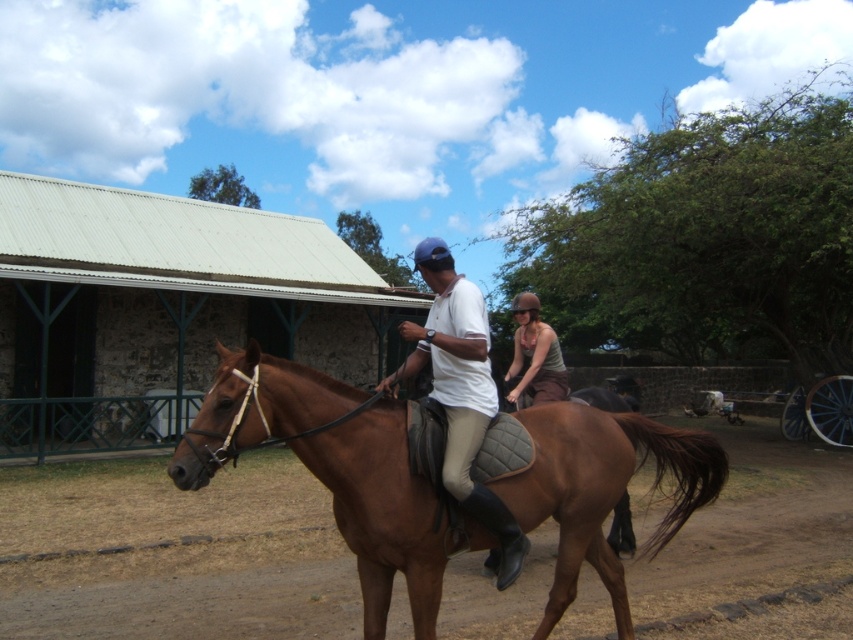
Question: Which object is closer to the camera taking this photo?

Choices:
 (A) white matte shirt at center
 (B) matte brown helmet at center

Answer: (A)

Question: Is brown glossy horse at center below matte brown helmet at center?

Choices:
 (A) no
 (B) yes

Answer: (B)

Question: Is white matte shirt at center wider than matte brown helmet at center?

Choices:
 (A) yes
 (B) no

Answer: (B)

Question: Considering the real-world distances, which object is farthest from the brown glossy horse at center?

Choices:
 (A) white matte shirt at center
 (B) matte brown helmet at center

Answer: (B)

Question: Does brown glossy horse at center appear under white matte shirt at center?

Choices:
 (A) no
 (B) yes

Answer: (B)

Question: Among these objects, which one is nearest to the camera?

Choices:
 (A) matte brown helmet at center
 (B) brown glossy horse at center

Answer: (B)